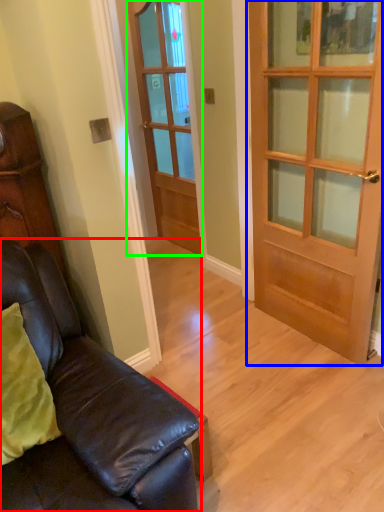
Question: Considering the real-world distances, which object is farthest from studio couch (highlighted by a red box)? door (highlighted by a blue box) or door (highlighted by a green box)?

Choices:
 (A) door
 (B) door

Answer: (B)